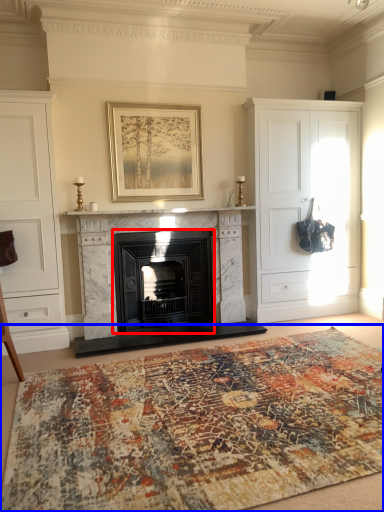
Question: Which of the following is the farthest to the observer, wood burning stove (highlighted by a red box) or mat (highlighted by a blue box)?

Choices:
 (A) wood burning stove
 (B) mat

Answer: (A)